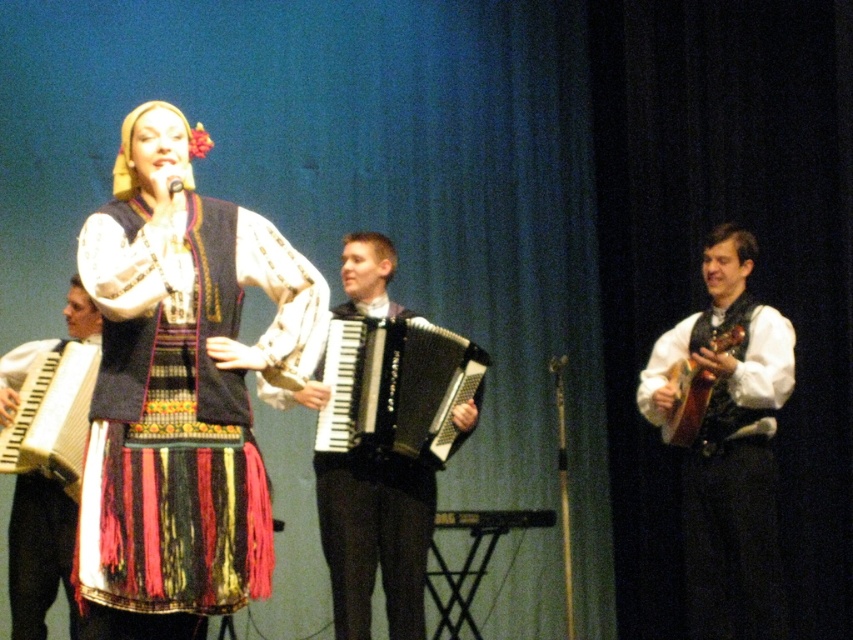
You are a stagehand setting up microphones for the performers. You see the black glossy accordion at center and the wooden accordion at center. Which one is positioned higher on the stage?

The black glossy accordion at center is positioned higher than the wooden accordion at center, so it is above it.

You are a stagehand setting up the lighting for the performance. You need to ensure that the spotlight can cover both the matte black vest at right and the black glossy accordion at center. Given that the spotlight has a fixed width, which object requires a wider beam to illuminate fully?

The black glossy accordion at center requires a wider spotlight beam because the matte black vest at right has a lesser width compared to it.

You are sitting in the audience and want to know which of the two points, point [39,568] or point [699,403], is closer to you. Based on the stage setup, can you determine which point is nearer?

Point [39,568] is closer to the viewer than point [699,403], so the first point is nearer.